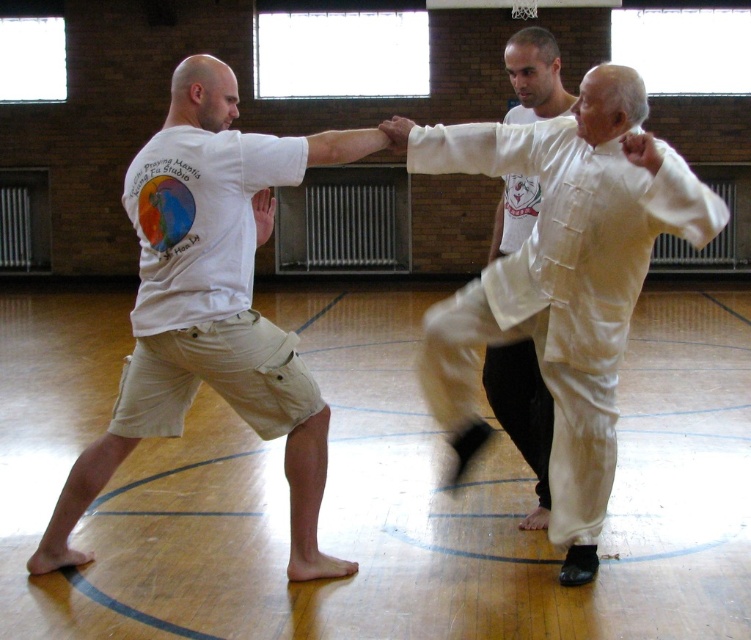
How far apart are white silk pants at right and white cotton t-shirt at center?

4.13 feet

Which of these two, white silk pants at right or white cotton t-shirt at center, stands shorter?

white silk pants at right is shorter.

Does point (578, 259) lie behind point (342, 154)?

No, it is in front of (342, 154).

Where is `white silk pants at right`? Image resolution: width=751 pixels, height=640 pixels. white silk pants at right is located at coordinates (559, 280).

Is white silk pants at right thinner than white silk shirt at center?

Incorrect, white silk pants at right's width is not less than white silk shirt at center's.

You are a GUI agent. You are given a task and a screenshot of the screen. Output one action in this format:
    pyautogui.click(x=<x>, y=<y>)
    Task: Click on the white silk pants at right
    This screenshot has width=751, height=640.
    Given the screenshot: What is the action you would take?
    pyautogui.click(x=559, y=280)

What do you see at coordinates (559, 280) in the screenshot? The width and height of the screenshot is (751, 640). I see `white silk pants at right` at bounding box center [559, 280].

Locate an element on the screen. white silk pants at right is located at coordinates (559, 280).

Who is more distant from viewer, [32,554] or [508,182]?

Positioned behind is point [508,182].

Looking at this image, can you confirm if white cotton t-shirt at center is shorter than white silk shirt at center?

Incorrect, white cotton t-shirt at center's height does not fall short of white silk shirt at center's.

Is point (342, 132) closer to viewer compared to point (550, 97)?

Yes, it is.

At what (x,y) coordinates should I click in order to perform the action: click on white cotton t-shirt at center. Please return your answer as a coordinate pair (x, y). Looking at the image, I should click on (213, 209).